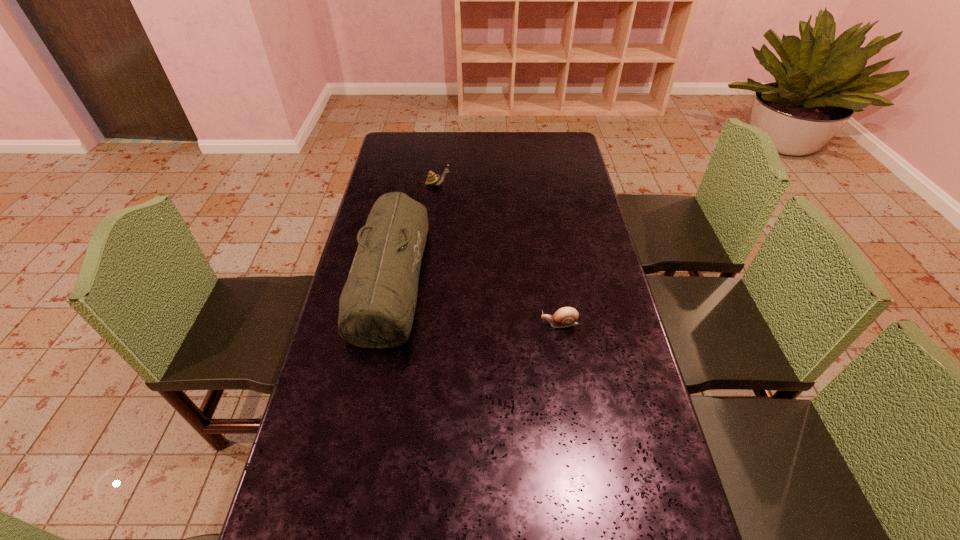
Locate an element on the screen. The width and height of the screenshot is (960, 540). object at the left edge is located at coordinates (377, 305).

The width and height of the screenshot is (960, 540). In order to click on object positioned at the right edge in this screenshot , I will do `click(567, 316)`.

Locate an element on the screen. free space at the far edge of the desktop is located at coordinates (472, 146).

At what (x,y) coordinates should I click in order to perform the action: click on vacant space at the left edge. Please return your answer as a coordinate pair (x, y). Looking at the image, I should click on (405, 190).

You are a GUI agent. You are given a task and a screenshot of the screen. Output one action in this format:
    pyautogui.click(x=<x>, y=<y>)
    Task: Click on the vacant space at the right edge of the desktop
    This screenshot has height=540, width=960.
    Given the screenshot: What is the action you would take?
    pyautogui.click(x=575, y=161)

In the image, there is a desktop. Where is `vacant region at the far right corner`? The width and height of the screenshot is (960, 540). vacant region at the far right corner is located at coordinates (538, 146).

What are the coordinates of `free area in between the tallest object and the right escargot` in the screenshot? It's located at (475, 300).

At what (x,y) coordinates should I click in order to perform the action: click on vacant area that lies between the tallest object and the nearer escargot. Please return your answer as a coordinate pair (x, y). Looking at the image, I should click on (475, 300).

The height and width of the screenshot is (540, 960). I want to click on empty space that is in between the farthest object and the nearer escargot, so click(498, 254).

Find the location of a particular element. The image size is (960, 540). free space between the tallest object and the shorter escargot is located at coordinates [x=475, y=300].